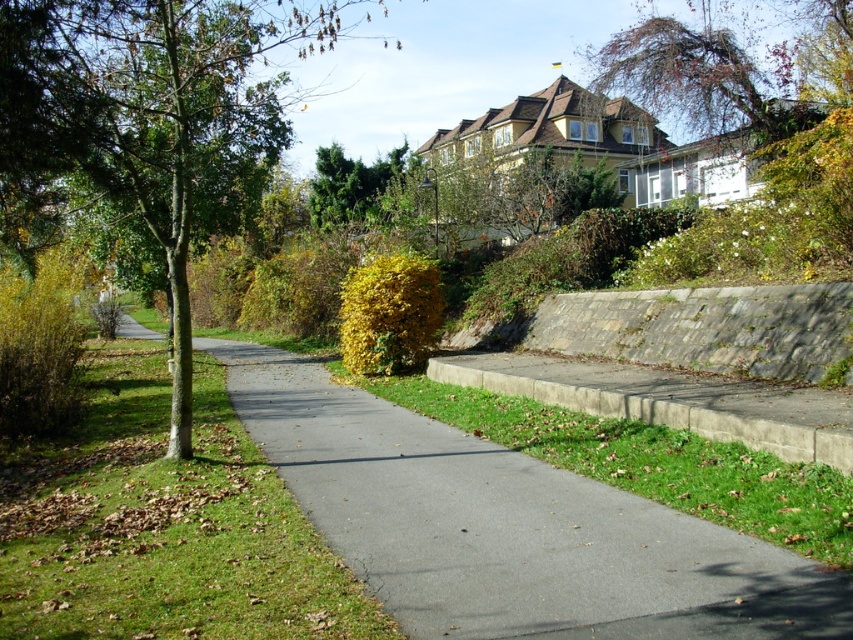
Question: Which object is farther from the camera taking this photo?

Choices:
 (A) gray concrete curb at lower right
 (B) green grass at left
 (C) reddish-brown bark tree at upper right

Answer: (C)

Question: Is green grass at left bigger than gray concrete curb at lower right?

Choices:
 (A) no
 (B) yes

Answer: (B)

Question: Is green grass at left to the right of green smooth tree at left from the viewer's perspective?

Choices:
 (A) no
 (B) yes

Answer: (B)

Question: Considering the real-world distances, which object is farthest from the reddish-brown bark tree at upper right?

Choices:
 (A) gray concrete curb at lower right
 (B) green smooth tree at left
 (C) gray asphalt pavement at center

Answer: (A)

Question: Among these objects, which one is nearest to the camera?

Choices:
 (A) green grass at left
 (B) gray asphalt pavement at center

Answer: (B)

Question: Where is gray asphalt pavement at center located in relation to green smooth tree at left in the image?

Choices:
 (A) right
 (B) left

Answer: (A)